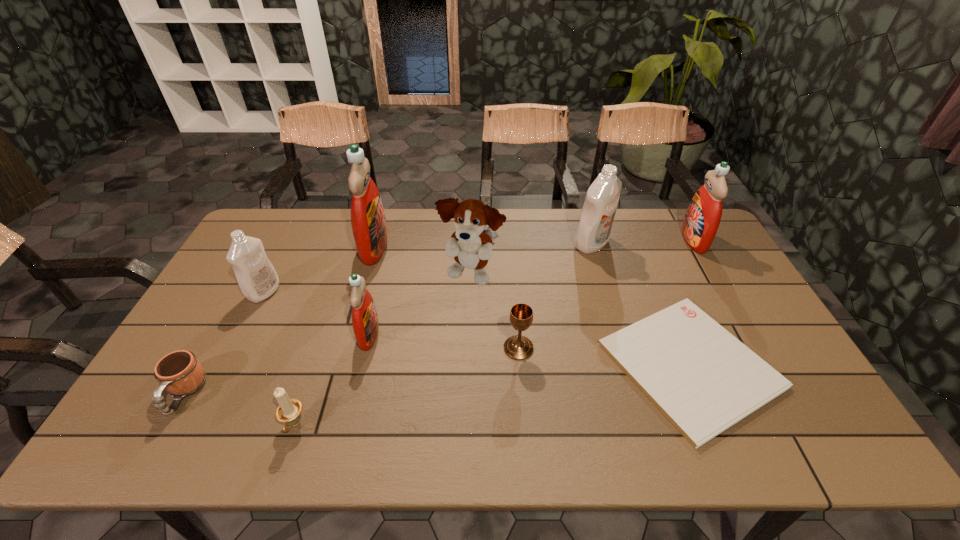
At what (x,y) coordinates should I click in order to perform the action: click on detergent at the right edge. Please return your answer as a coordinate pair (x, y). The image size is (960, 540). Looking at the image, I should click on (703, 216).

This screenshot has width=960, height=540. Find the location of `clipboard that is at the right edge`. clipboard that is at the right edge is located at coordinates (703, 379).

Find the location of `object that is positioned at the near left corner`. object that is positioned at the near left corner is located at coordinates (180, 373).

Find the location of a particular element. The width and height of the screenshot is (960, 540). object positioned at the far right corner is located at coordinates (703, 216).

Locate an element on the screen. object that is positioned at the near right corner is located at coordinates (703, 379).

Where is `free space at the far edge`? The height and width of the screenshot is (540, 960). free space at the far edge is located at coordinates (565, 247).

In the image, there is a desktop. Identify the location of free region at the near edge. (517, 421).

Where is `free space at the right edge`? This screenshot has height=540, width=960. free space at the right edge is located at coordinates click(759, 329).

Identify the location of vacant space at the far left corner of the desktop. Image resolution: width=960 pixels, height=540 pixels. (264, 245).

Where is `free space between the biggest red detergent and the nearest detergent`? The height and width of the screenshot is (540, 960). free space between the biggest red detergent and the nearest detergent is located at coordinates (372, 291).